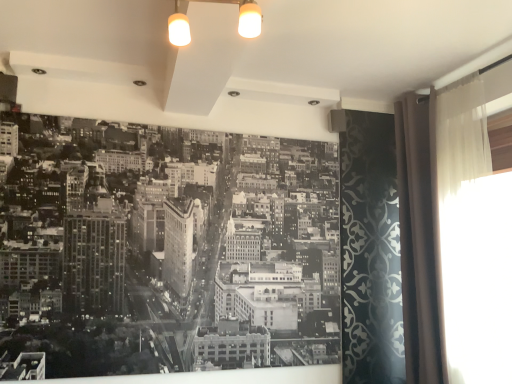
Question: Does point (260, 302) appear closer or farther from the camera than point (508, 97)?

Choices:
 (A) farther
 (B) closer

Answer: (A)

Question: Based on their sizes in the image, would you say black paper at center is bigger or smaller than translucent fabric curtain at right?

Choices:
 (A) big
 (B) small

Answer: (A)

Question: Which object is positioned closest to the black paper at center?

Choices:
 (A) beige fabric curtain at right
 (B) translucent fabric curtain at right

Answer: (A)

Question: Which object is the closest to the translucent fabric curtain at right?

Choices:
 (A) beige fabric curtain at right
 (B) black paper at center

Answer: (A)